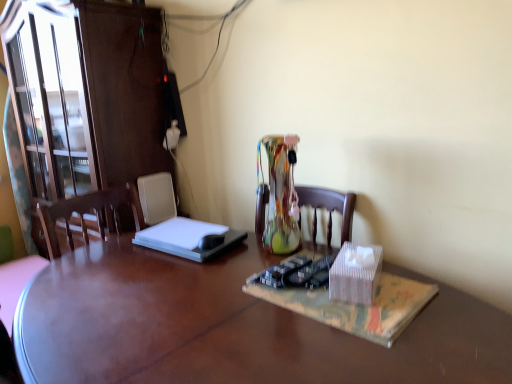
Where is `vacant space positioned to the left of translucent plastic book at center`? vacant space positioned to the left of translucent plastic book at center is located at coordinates (213, 310).